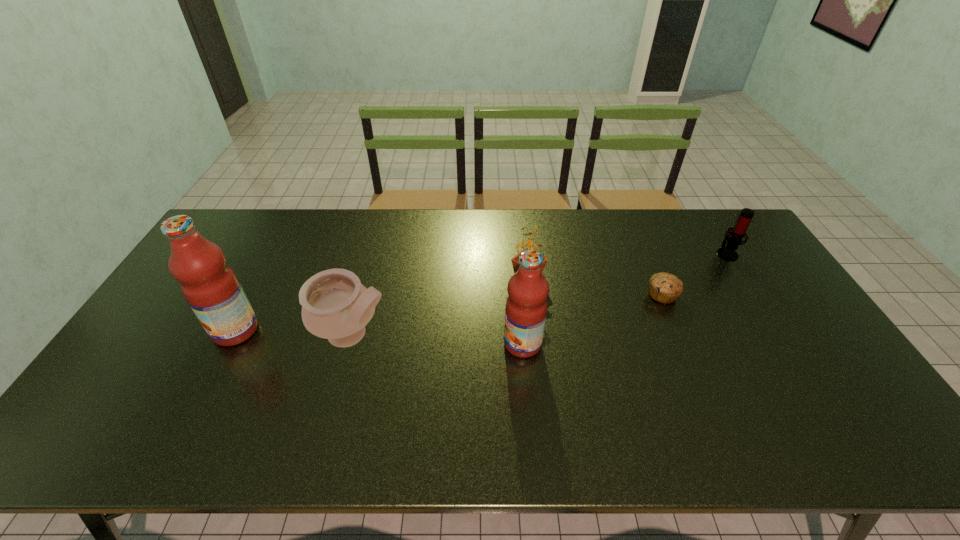
You are a GUI agent. You are given a task and a screenshot of the screen. Output one action in this format:
    pyautogui.click(x=<x>, y=<y>)
    Task: Click on the object present at the far edge
    The width and height of the screenshot is (960, 540).
    Given the screenshot: What is the action you would take?
    pyautogui.click(x=731, y=241)

The height and width of the screenshot is (540, 960). Find the location of `object that is at the right edge`. object that is at the right edge is located at coordinates (731, 241).

Where is `object that is positioned at the far right corner`? The image size is (960, 540). object that is positioned at the far right corner is located at coordinates (731, 241).

This screenshot has width=960, height=540. In the image, there is a desktop. What are the coordinates of `vacant space at the far edge` in the screenshot? It's located at (616, 247).

Where is `free location at the near edge`? The image size is (960, 540). free location at the near edge is located at coordinates (680, 411).

At what (x,y) coordinates should I click in order to perform the action: click on vacant area at the left edge of the desktop. Please return your answer as a coordinate pair (x, y). This screenshot has height=540, width=960. Looking at the image, I should click on (238, 261).

Locate an element on the screen. free point at the right edge is located at coordinates (x=793, y=318).

Locate an element on the screen. Image resolution: width=960 pixels, height=540 pixels. free space that is in between the second object from left to right and the taller fruit juice is located at coordinates (295, 333).

Locate an element on the screen. The height and width of the screenshot is (540, 960). free space between the taller fruit juice and the shorter fruit juice is located at coordinates (379, 337).

Locate an element on the screen. The height and width of the screenshot is (540, 960). free spot between the microphone and the shortest object is located at coordinates (694, 274).